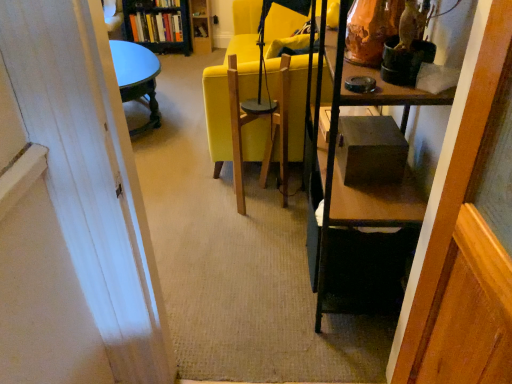
Question: Does wooden swivel chair at center have a greater width compared to matte yellow chair at center?

Choices:
 (A) no
 (B) yes

Answer: (A)

Question: Is wooden swivel chair at center next to matte yellow chair at center and touching it?

Choices:
 (A) no
 (B) yes

Answer: (A)

Question: Does wooden swivel chair at center have a lesser width compared to matte yellow chair at center?

Choices:
 (A) yes
 (B) no

Answer: (A)

Question: Considering the relative sizes of wooden swivel chair at center and matte yellow chair at center in the image provided, is wooden swivel chair at center taller than matte yellow chair at center?

Choices:
 (A) yes
 (B) no

Answer: (B)

Question: Is wooden swivel chair at center positioned in front of matte yellow chair at center?

Choices:
 (A) yes
 (B) no

Answer: (A)

Question: Does wooden swivel chair at center appear on the left side of matte yellow chair at center?

Choices:
 (A) no
 (B) yes

Answer: (B)

Question: Is hardcover book at upper center, the 1th book from the top, thinner than hardcover books at upper left, the first book when ordered from bottom to top?

Choices:
 (A) yes
 (B) no

Answer: (A)

Question: Is hardcover book at upper center, arranged as the second book when ordered from the bottom, positioned with its back to hardcover books at upper left, which is the second book in top-to-bottom order?

Choices:
 (A) yes
 (B) no

Answer: (B)

Question: Is hardcover book at upper center, arranged as the second book when ordered from the bottom, with hardcover books at upper left, which is the second book in top-to-bottom order?

Choices:
 (A) no
 (B) yes

Answer: (A)

Question: Is hardcover book at upper center, arranged as the second book when ordered from the bottom, to the left of hardcover books at upper left, the first book when ordered from bottom to top, from the viewer's perspective?

Choices:
 (A) no
 (B) yes

Answer: (A)

Question: Does hardcover book at upper center, arranged as the second book when ordered from the bottom, have a smaller size compared to hardcover books at upper left, the first book when ordered from bottom to top?

Choices:
 (A) no
 (B) yes

Answer: (B)

Question: Is hardcover books at upper left, the first book when ordered from bottom to top, located within hardcover book at upper center, arranged as the second book when ordered from the bottom?

Choices:
 (A) no
 (B) yes

Answer: (A)

Question: Considering the relative sizes of hardcover books at upper left, the first book when ordered from bottom to top, and wooden swivel chair at center in the image provided, is hardcover books at upper left, the first book when ordered from bottom to top, smaller than wooden swivel chair at center?

Choices:
 (A) no
 (B) yes

Answer: (B)